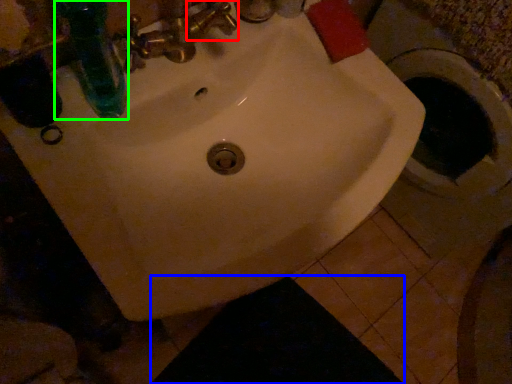
Question: Which object is positioned closest to plumbing fixture (highlighted by a red box)? Select from dark (highlighted by a blue box) and bottle (highlighted by a green box).

Choices:
 (A) dark
 (B) bottle

Answer: (B)